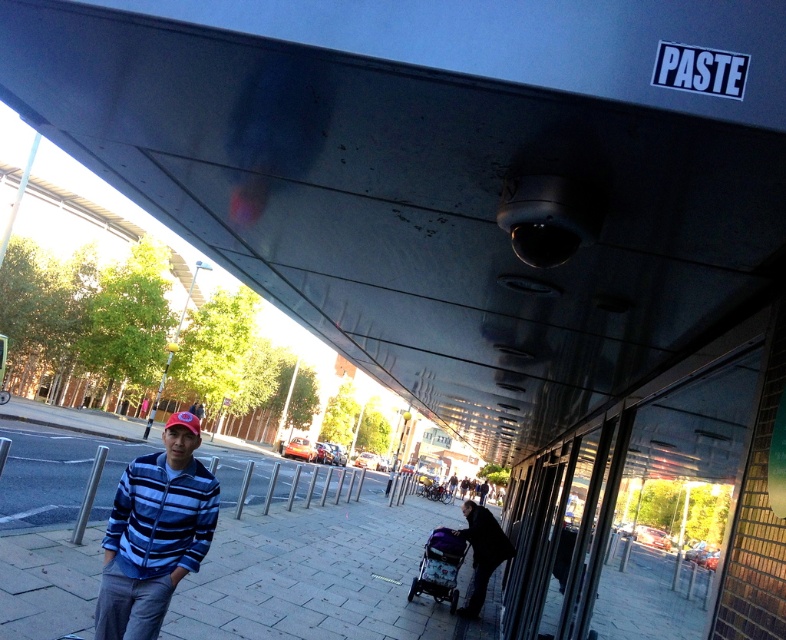
Is blue striped jacket at center above purple fabric stroller at center?

Indeed, blue striped jacket at center is positioned over purple fabric stroller at center.

Does blue striped jacket at center appear on the left side of purple fabric stroller at center?

Indeed, blue striped jacket at center is positioned on the left side of purple fabric stroller at center.

This screenshot has width=786, height=640. What are the coordinates of `blue striped jacket at center` in the screenshot? It's located at (155, 532).

Is gray concrete pavement at lower left positioned behind purple fabric stroller at center?

No, gray concrete pavement at lower left is closer to the viewer.

Is point (39, 637) behind point (417, 572)?

No, it is in front of (417, 572).

What do you see at coordinates (314, 557) in the screenshot? This screenshot has width=786, height=640. I see `gray concrete pavement at lower left` at bounding box center [314, 557].

Identify the location of gray concrete pavement at lower left. Image resolution: width=786 pixels, height=640 pixels. (314, 557).

Is gray concrete pavement at lower left closer to the viewer compared to blue striped jacket at center?

Yes, gray concrete pavement at lower left is in front of blue striped jacket at center.

Is point (43, 465) positioned in front of point (149, 506)?

No, it is behind (149, 506).

Find the location of a particular element. The width and height of the screenshot is (786, 640). gray concrete pavement at lower left is located at coordinates (314, 557).